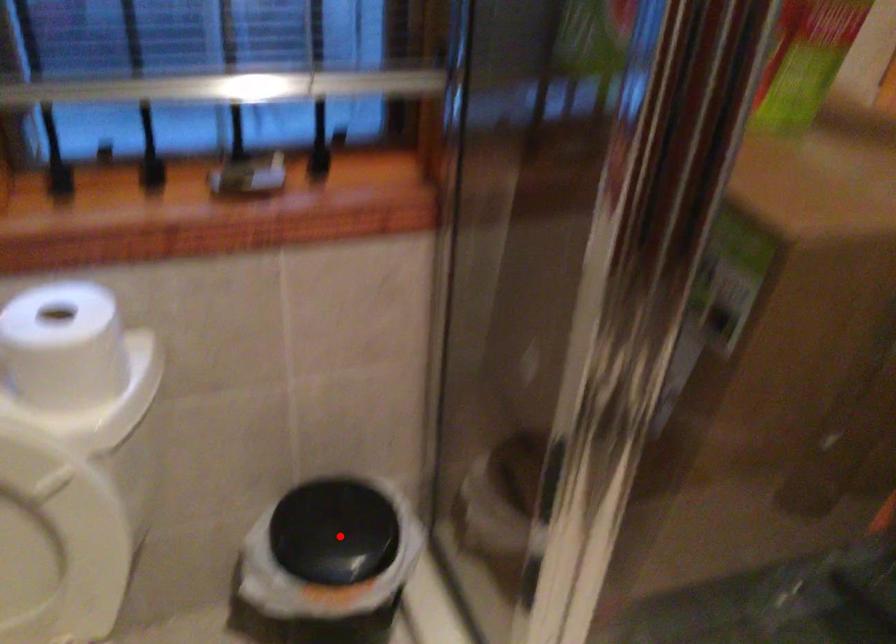
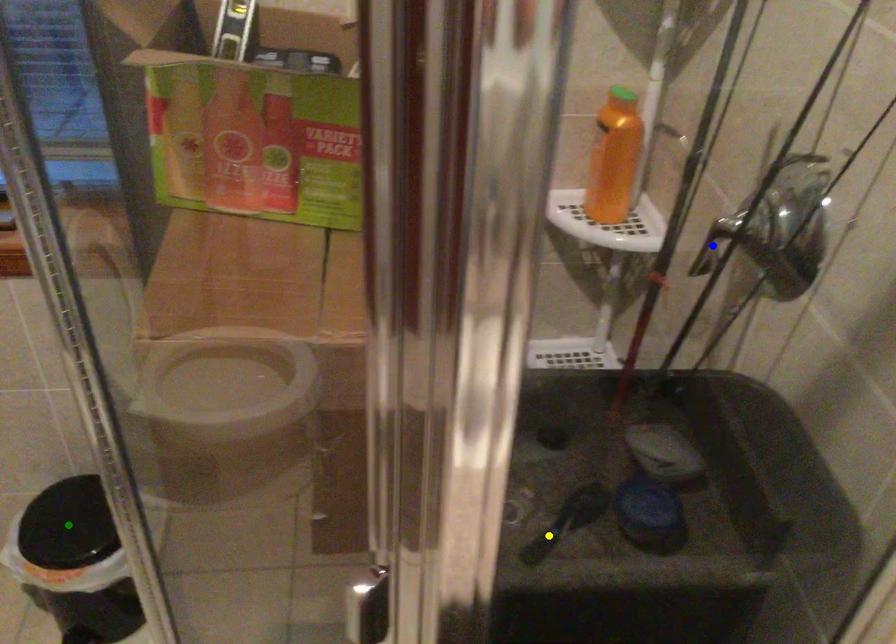
Question: I am providing you with two images of the same scene from different viewpoints. A red point is marked on the first image. You are given multiple points on the second image. Which point in image 2 represents the same 3d spot as the red point in image 1?

Choices:
 (A) green point
 (B) blue point
 (C) yellow point

Answer: (A)